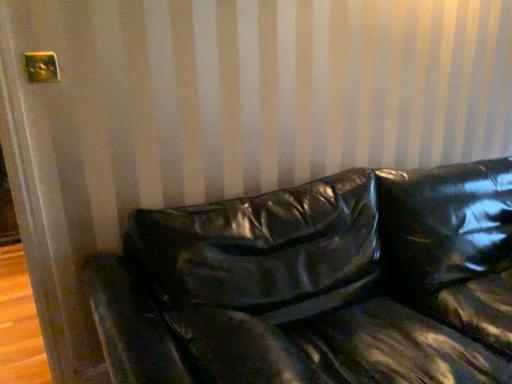
Question: Relative to metallic gold outlet at upper left, is glossy black couch at center in front or behind?

Choices:
 (A) behind
 (B) front

Answer: (B)

Question: Considering the positions of point (263, 336) and point (34, 67), is point (263, 336) closer or farther from the camera than point (34, 67)?

Choices:
 (A) closer
 (B) farther

Answer: (A)

Question: From the image's perspective, relative to metallic gold outlet at upper left, is glossy black couch at center above or below?

Choices:
 (A) below
 (B) above

Answer: (A)

Question: From a real-world perspective, is metallic gold outlet at upper left above or below glossy black couch at center?

Choices:
 (A) below
 (B) above

Answer: (B)

Question: Considering the positions of metallic gold outlet at upper left and glossy black couch at center in the image, is metallic gold outlet at upper left taller or shorter than glossy black couch at center?

Choices:
 (A) tall
 (B) short

Answer: (B)

Question: Is metallic gold outlet at upper left in front of or behind glossy black couch at center in the image?

Choices:
 (A) behind
 (B) front

Answer: (A)

Question: From the image's perspective, is metallic gold outlet at upper left positioned above or below glossy black couch at center?

Choices:
 (A) above
 (B) below

Answer: (A)